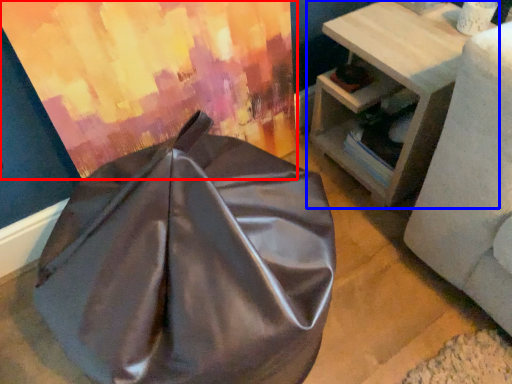
Question: Which point is further to the camera, curtain (highlighted by a red box) or table (highlighted by a blue box)?

Choices:
 (A) curtain
 (B) table

Answer: (B)